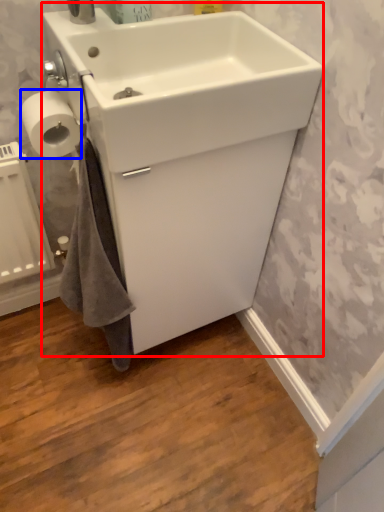
Question: Which object is further to the camera taking this photo, sink (highlighted by a red box) or toilet paper (highlighted by a blue box)?

Choices:
 (A) sink
 (B) toilet paper

Answer: (B)